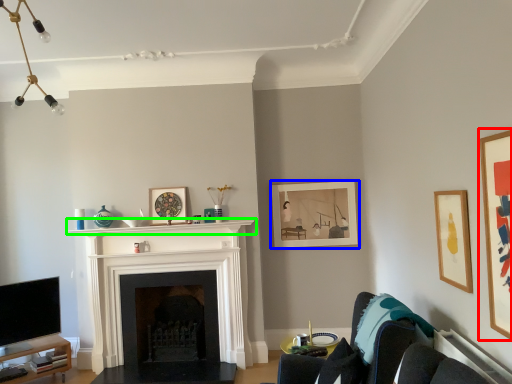
Question: Which object is positioned closest to picture frame (highlighted by a red box)? Select from picture frame (highlighted by a blue box) and mantle (highlighted by a green box).

Choices:
 (A) picture frame
 (B) mantle

Answer: (A)